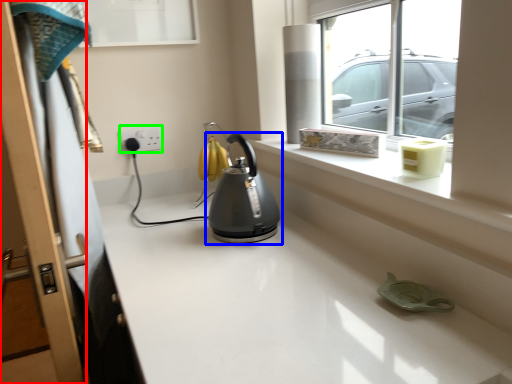
Question: Which object is the farthest from screen door (highlighted by a red box)? Choose among these: kettle (highlighted by a blue box) or electric outlet (highlighted by a green box).

Choices:
 (A) kettle
 (B) electric outlet

Answer: (B)